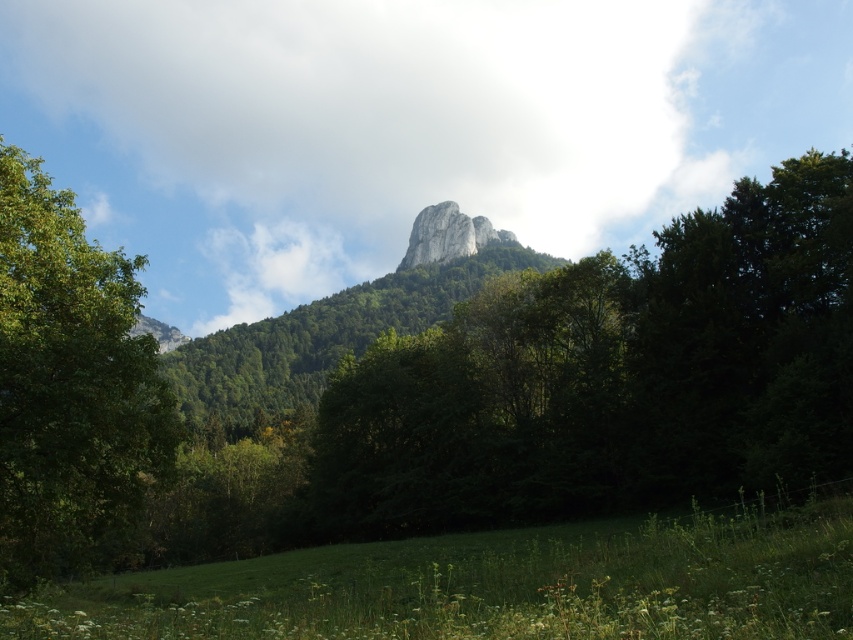
Question: Can you confirm if green leafy tree at center is positioned above white rock formation at center?

Choices:
 (A) no
 (B) yes

Answer: (A)

Question: Based on their relative distances, which object is nearer to the green grass at lower center?

Choices:
 (A) green leafy tree at center
 (B) white rock formation at center

Answer: (A)

Question: Which of the following is the closest to the observer?

Choices:
 (A) green leafy tree at left
 (B) green grass at lower center
 (C) green leafy tree at center
 (D) white rock formation at center

Answer: (B)

Question: Is the position of green leafy tree at center more distant than that of white rock formation at center?

Choices:
 (A) yes
 (B) no

Answer: (B)

Question: Considering the relative positions of green leafy tree at center and green grass at lower center in the image provided, where is green leafy tree at center located with respect to green grass at lower center?

Choices:
 (A) below
 (B) above

Answer: (B)

Question: Which point is closer to the camera?

Choices:
 (A) (329, 253)
 (B) (137, 440)

Answer: (B)